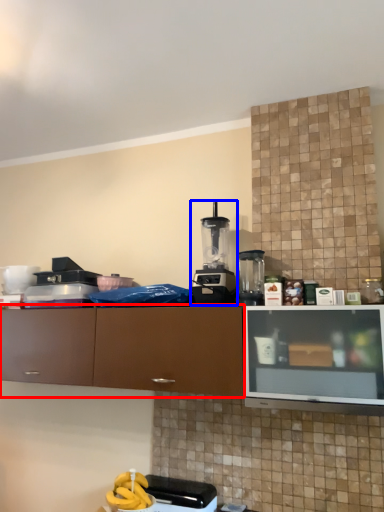
Question: Which object is closer to the camera taking this photo, cabinetry (highlighted by a red box) or kitchen appliance (highlighted by a blue box)?

Choices:
 (A) cabinetry
 (B) kitchen appliance

Answer: (A)